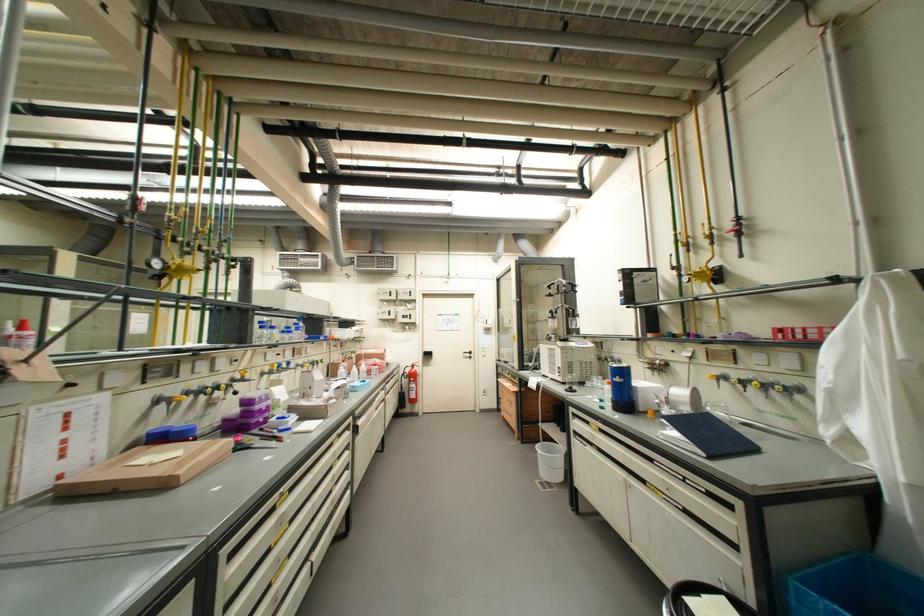
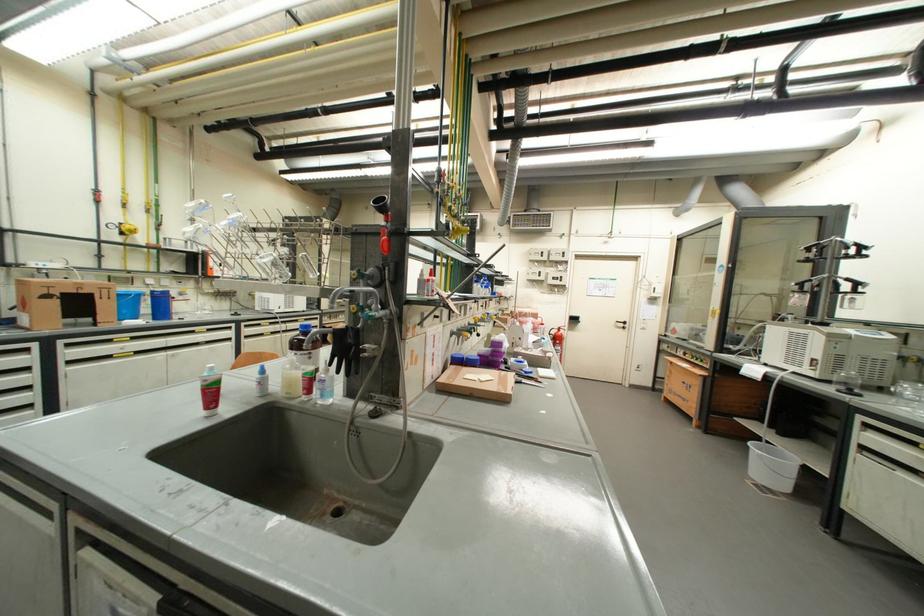
Question: Which direction would the cameraman need to move to produce the second image? Reply with the corresponding letter.

Choices:
 (A) Left
 (B) Right
 (C) Forward
 (D) Backward

Answer: (A)